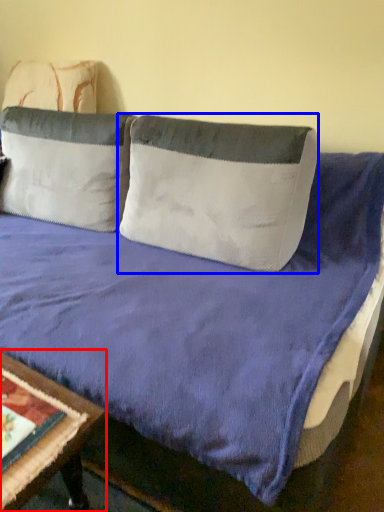
Question: Which point is closer to the camera, table (highlighted by a red box) or pillow (highlighted by a blue box)?

Choices:
 (A) table
 (B) pillow

Answer: (A)